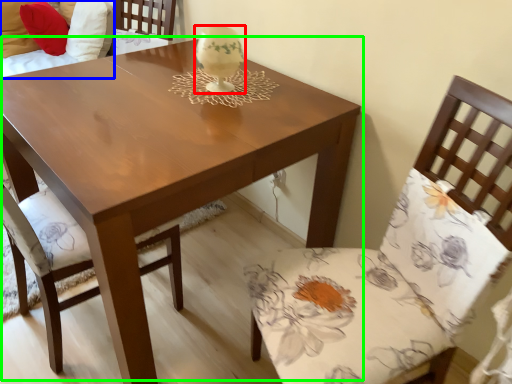
Question: Considering the real-world distances, which object is farthest from candle holder (highlighted by a red box)? couch (highlighted by a blue box) or coffee table (highlighted by a green box)?

Choices:
 (A) couch
 (B) coffee table

Answer: (A)